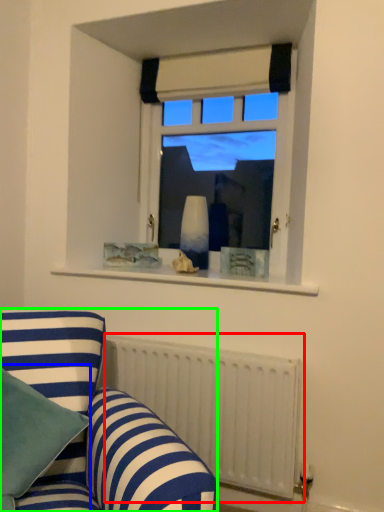
Question: Which object is the closest to the radiator (highlighted by a red box)? Choose among these: pillow (highlighted by a blue box) or studio couch (highlighted by a green box).

Choices:
 (A) pillow
 (B) studio couch

Answer: (B)